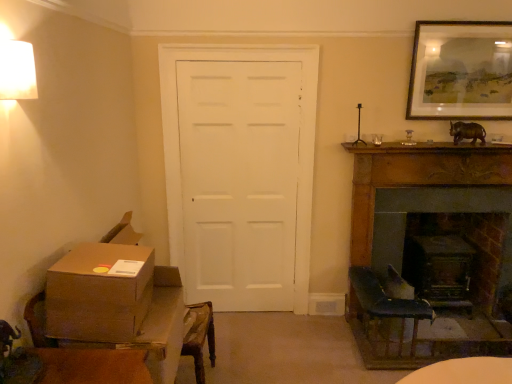
Question: From the image's perspective, would you say dark wood fireplace at right, which is counted as the 2th fireplace, starting from the front, is shown under brown cardboard box at lower left?

Choices:
 (A) yes
 (B) no

Answer: (A)

Question: From the image's perspective, is dark wood fireplace at right, which is counted as the 2th fireplace, starting from the front, above brown cardboard box at lower left?

Choices:
 (A) no
 (B) yes

Answer: (A)

Question: Is dark wood fireplace at right, which is counted as the 2th fireplace, starting from the front, thinner than brown cardboard box at lower left?

Choices:
 (A) yes
 (B) no

Answer: (B)

Question: From a real-world perspective, is dark wood fireplace at right, acting as the first fireplace starting from the back, positioned over brown cardboard box at lower left based on gravity?

Choices:
 (A) no
 (B) yes

Answer: (A)

Question: Does dark wood fireplace at right, which is counted as the 2th fireplace, starting from the front, appear on the left side of brown cardboard box at lower left?

Choices:
 (A) no
 (B) yes

Answer: (A)

Question: Is dark wood fireplace at right, acting as the first fireplace starting from the back, outside of brown cardboard box at lower left?

Choices:
 (A) no
 (B) yes

Answer: (B)

Question: Can you confirm if brown cardboard box at lower left is thinner than dark wood fireplace at right, acting as the first fireplace starting from the back?

Choices:
 (A) yes
 (B) no

Answer: (A)

Question: From the image's perspective, is brown cardboard box at lower left on dark wood fireplace at right, which is counted as the 2th fireplace, starting from the front?

Choices:
 (A) yes
 (B) no

Answer: (B)

Question: Is brown cardboard box at lower left turned away from dark wood fireplace at right, acting as the first fireplace starting from the back?

Choices:
 (A) yes
 (B) no

Answer: (B)

Question: Can you confirm if brown cardboard box at lower left is positioned to the right of dark wood fireplace at right, which is counted as the 2th fireplace, starting from the front?

Choices:
 (A) no
 (B) yes

Answer: (A)

Question: Is brown cardboard box at lower left positioned far away from dark wood fireplace at right, acting as the first fireplace starting from the back?

Choices:
 (A) no
 (B) yes

Answer: (B)

Question: Is brown cardboard box at lower left at the left side of dark wood fireplace at right, acting as the first fireplace starting from the back?

Choices:
 (A) no
 (B) yes

Answer: (B)

Question: Can you confirm if dark wood fireplace at right, acting as the first fireplace starting from the back, is wider than wooden framed artwork at upper right?

Choices:
 (A) no
 (B) yes

Answer: (B)